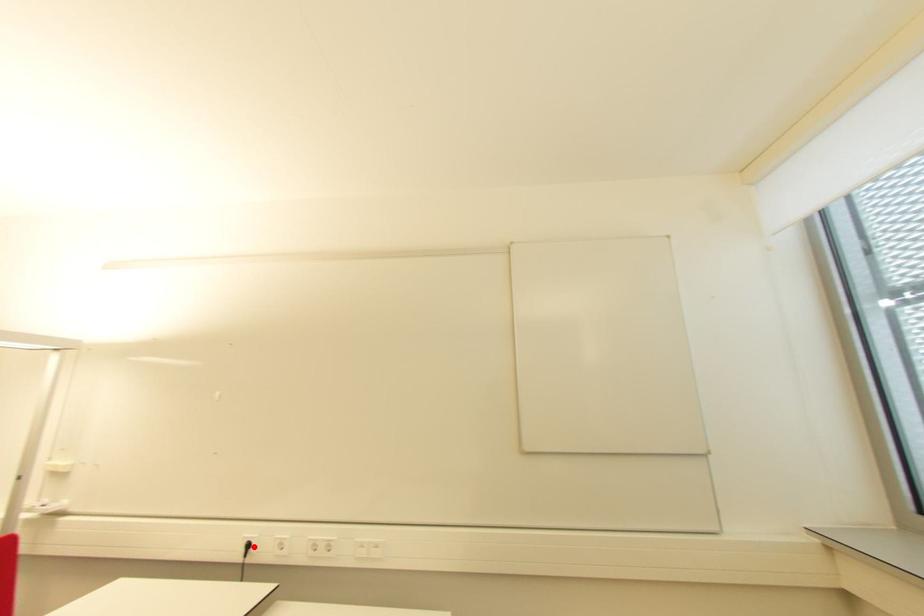
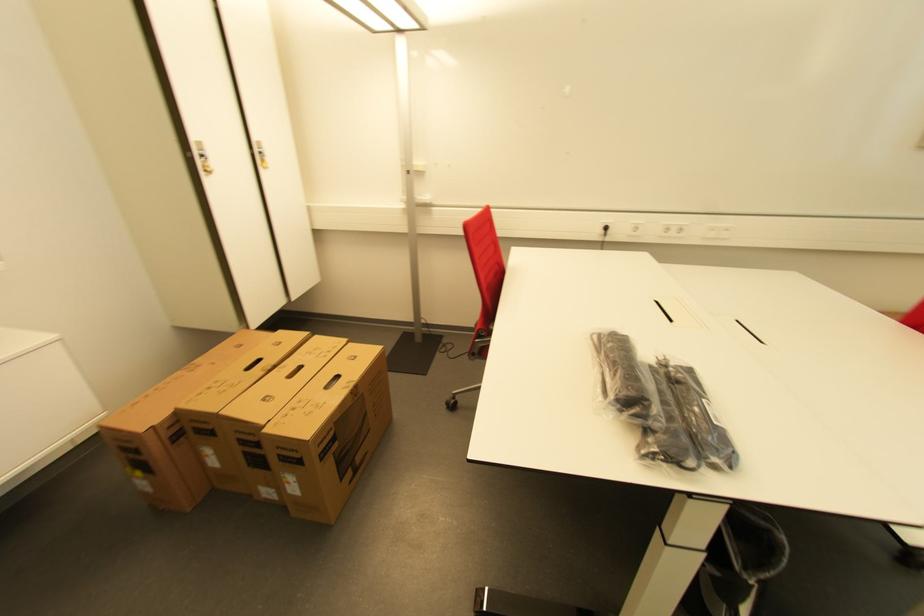
Locate, in the second image, the point that corresponds to the highlighted location in the first image.

(611, 230)